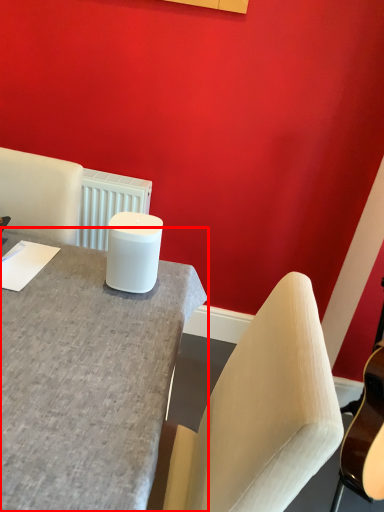
Question: From the image, what is the correct spatial relationship of desk (annotated by the red box) in relation to candle holder?

Choices:
 (A) left
 (B) right

Answer: (B)